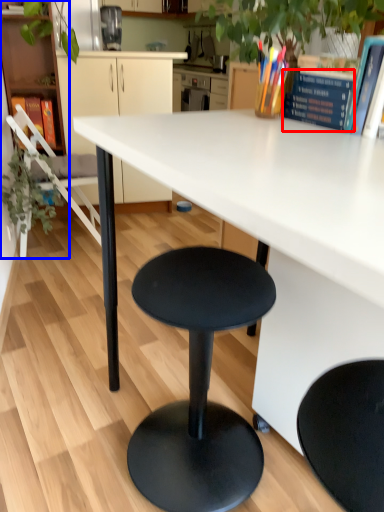
Question: Among these objects, which one is nearest to the camera, book (highlighted by a red box) or bookshelf (highlighted by a blue box)?

Choices:
 (A) book
 (B) bookshelf

Answer: (A)